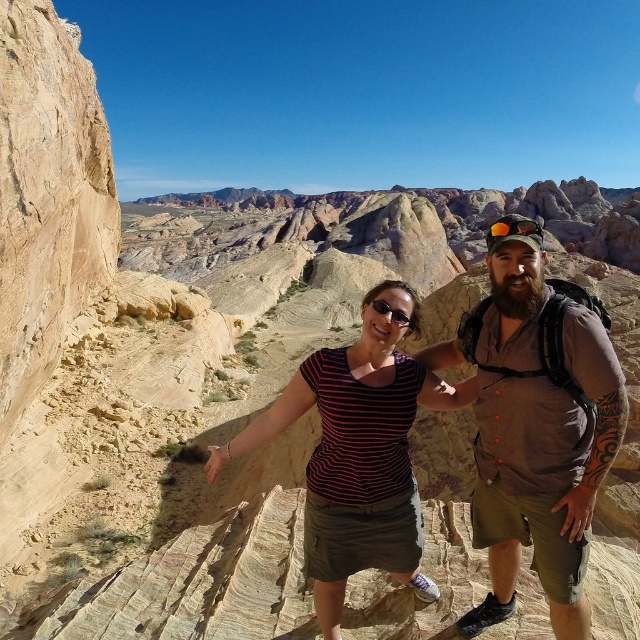
Question: Can you confirm if brown cotton shirt at center is wider than striped fabric shirt at center?

Choices:
 (A) no
 (B) yes

Answer: (A)

Question: Which point is farther to the camera?

Choices:
 (A) (563, 564)
 (B) (358, 458)
 (C) (502, 218)

Answer: (C)

Question: Can you confirm if brown cotton shirt at center is positioned to the right of striped fabric shirt at center?

Choices:
 (A) yes
 (B) no

Answer: (A)

Question: Can you confirm if brown cotton shirt at center is positioned above matte orange goggles at upper right?

Choices:
 (A) yes
 (B) no

Answer: (B)

Question: Considering the real-world distances, which object is closest to the brown cotton shirt at center?

Choices:
 (A) striped fabric shirt at center
 (B) matte orange goggles at upper right

Answer: (A)

Question: Which of these objects is positioned closest to the brown cotton shirt at center?

Choices:
 (A) matte orange goggles at upper right
 (B) striped fabric shirt at center

Answer: (B)